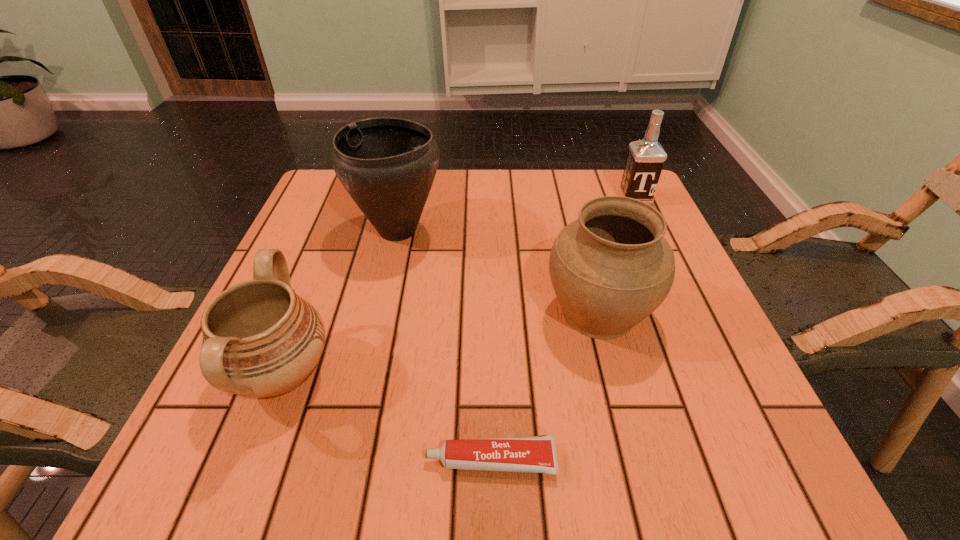
The height and width of the screenshot is (540, 960). Identify the location of the farthest urn. (387, 165).

Identify the location of the rightmost object. (645, 160).

Image resolution: width=960 pixels, height=540 pixels. Identify the location of the second object from right to left. [x=611, y=268].

Find the location of a particular element. The height and width of the screenshot is (540, 960). toothpaste is located at coordinates click(x=537, y=454).

Image resolution: width=960 pixels, height=540 pixels. Identify the location of the third object from left to right. (537, 454).

You are a GUI agent. You are given a task and a screenshot of the screen. Output one action in this format:
    pyautogui.click(x=<x>, y=<y>)
    Task: Click on the vacant space situated 0.100m on the front of the farthest urn
    
    Given the screenshot: What is the action you would take?
    pyautogui.click(x=383, y=293)

Where is `vacant space located 0.200m on the front label of the vodka`? This screenshot has height=540, width=960. vacant space located 0.200m on the front label of the vodka is located at coordinates (662, 259).

What are the coordinates of `vacant area situated on the back of the rightmost urn` in the screenshot? It's located at (564, 180).

At what (x,y) coordinates should I click in order to perform the action: click on vacant space located 0.360m at the nozzle of the toothpaste. Please return your answer as a coordinate pair (x, y). Looking at the image, I should click on (178, 460).

Find the location of `vacant space located 0.110m at the nozzle of the toothpaste`. vacant space located 0.110m at the nozzle of the toothpaste is located at coordinates (350, 460).